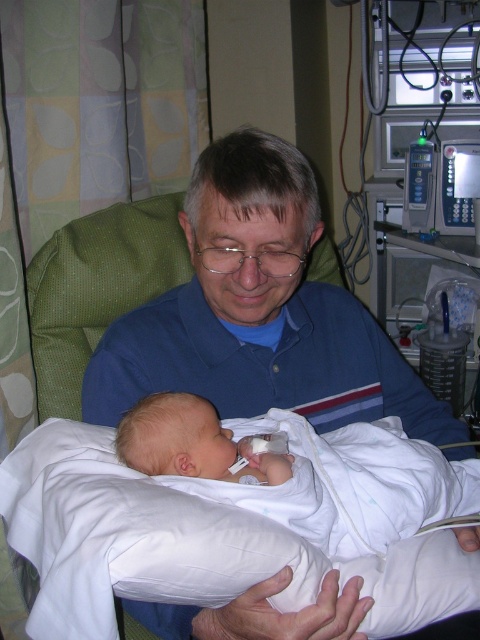
Question: Is blue cotton shirt at center above white soft swaddled newborn at center?

Choices:
 (A) yes
 (B) no

Answer: (A)

Question: Which point is closer to the camera?

Choices:
 (A) blue cotton shirt at center
 (B) white soft swaddled newborn at center

Answer: (B)

Question: Can you confirm if blue cotton shirt at center is positioned above white soft swaddled newborn at center?

Choices:
 (A) yes
 (B) no

Answer: (A)

Question: Which point is closer to the camera?

Choices:
 (A) (450, 513)
 (B) (335, 323)

Answer: (A)

Question: Can you confirm if blue cotton shirt at center is bigger than white soft swaddled newborn at center?

Choices:
 (A) no
 (B) yes

Answer: (B)

Question: Which object is closer to the camera taking this photo?

Choices:
 (A) white soft swaddled newborn at center
 (B) blue cotton shirt at center

Answer: (A)